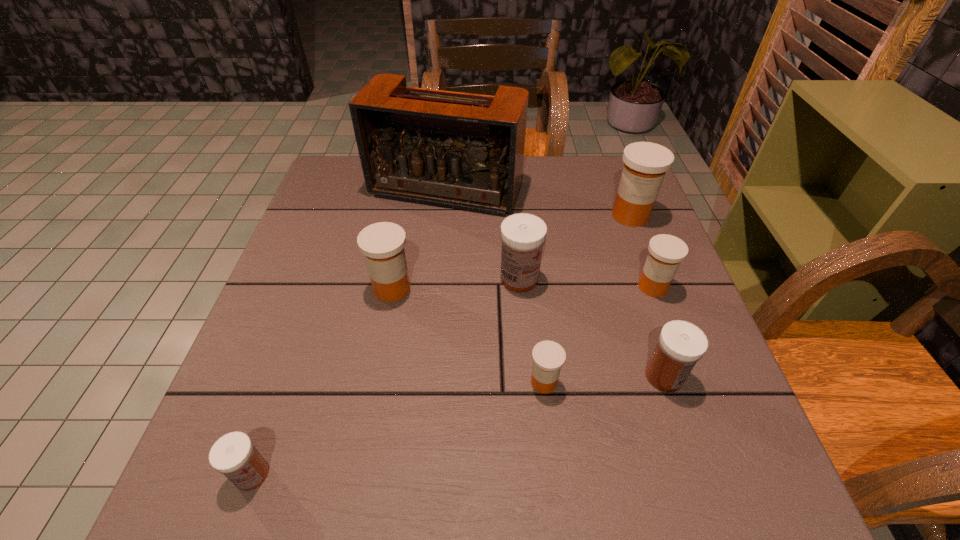
Locate an element on the screen. vacant region that satisfies the following two spatial constraints: 1. on the label of the leftmost orange medicine; 2. on the right side of the rightmost white medicine is located at coordinates (375, 376).

The width and height of the screenshot is (960, 540). In order to click on vacant position in the image that satisfies the following two spatial constraints: 1. on the label of the third biggest orange medicine; 2. on the label of the leftmost orange medicine in this screenshot , I will do `click(654, 288)`.